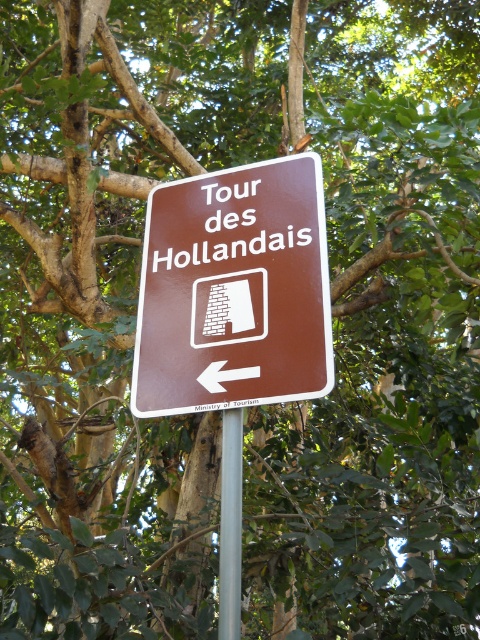
Question: Which point is closer to the camera?

Choices:
 (A) brown matte sign at center
 (B) silver metallic pole at center

Answer: (B)

Question: Which point appears farthest from the camera in this image?

Choices:
 (A) (231, 467)
 (B) (308, 172)

Answer: (B)

Question: Is brown matte sign at center to the left of silver metallic pole at center from the viewer's perspective?

Choices:
 (A) no
 (B) yes

Answer: (B)

Question: Observing the image, what is the correct spatial positioning of brown matte sign at center in reference to silver metallic pole at center?

Choices:
 (A) right
 (B) left

Answer: (B)

Question: Which point is farther to the camera?

Choices:
 (A) brown matte sign at center
 (B) silver metallic pole at center

Answer: (A)

Question: Is brown matte sign at center to the right of silver metallic pole at center from the viewer's perspective?

Choices:
 (A) no
 (B) yes

Answer: (A)